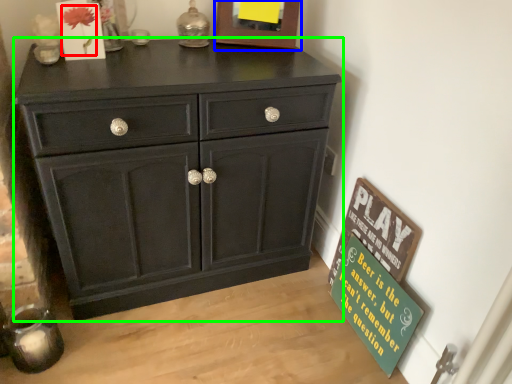
Question: Estimate the real-world distances between objects in this image. Which object is farther from flower (highlighted by a red box), picture frame (highlighted by a blue box) or chest of drawers (highlighted by a green box)?

Choices:
 (A) picture frame
 (B) chest of drawers

Answer: (B)